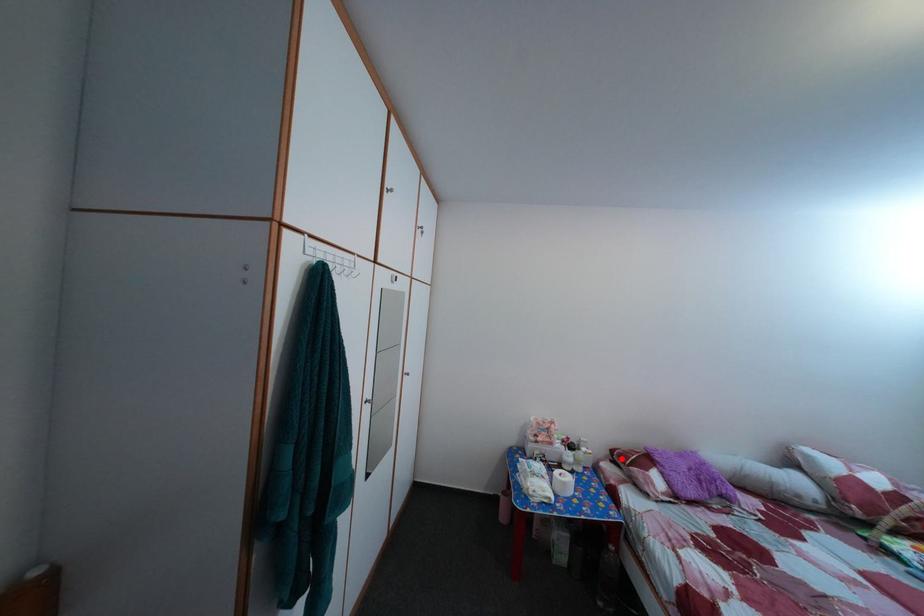
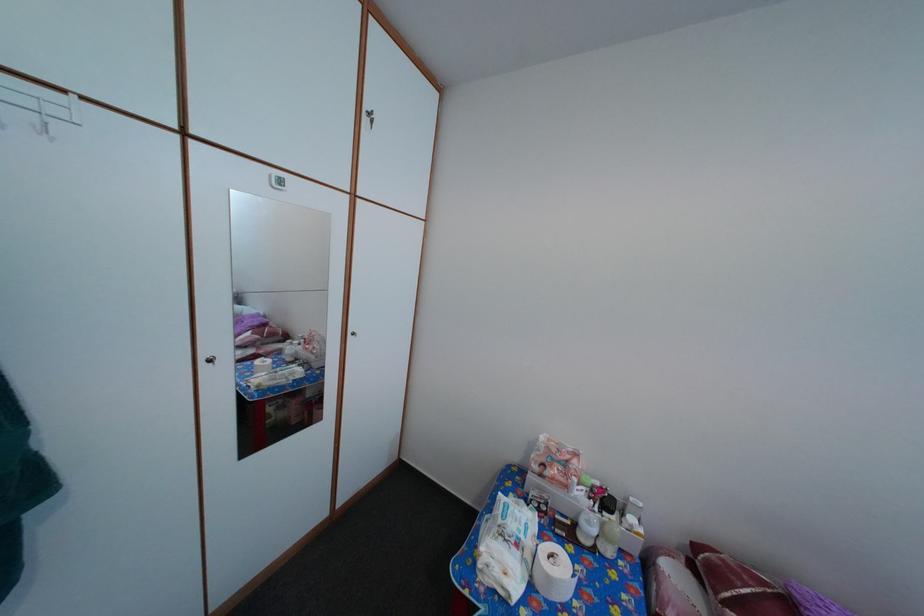
The point at the highlighted location is marked in the first image. Where is the corresponding point in the second image?

(704, 554)